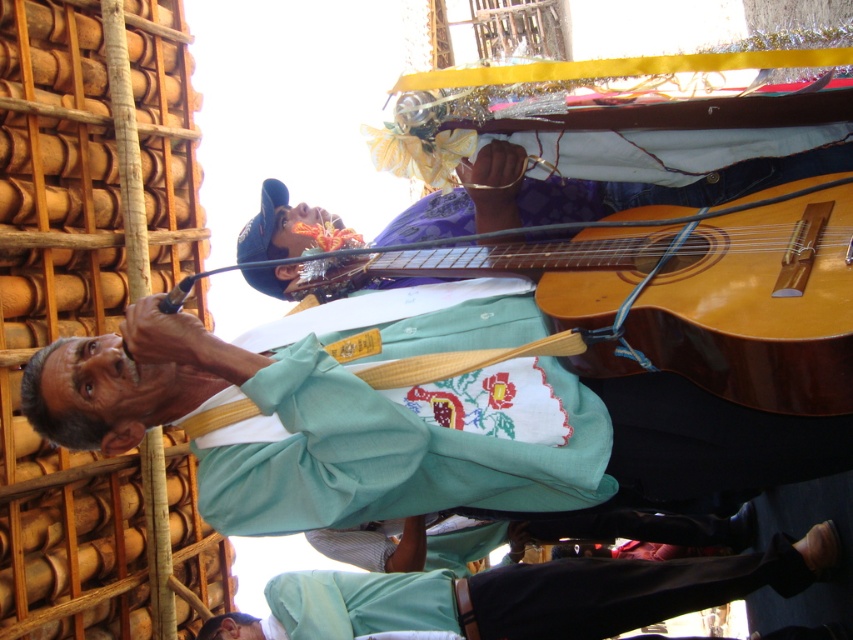
Based on the photo, does light brown wood guitar at center have a greater width compared to light blue fabric pants at lower center?

In fact, light brown wood guitar at center might be narrower than light blue fabric pants at lower center.

Can you confirm if light brown wood guitar at center is thinner than light blue fabric pants at lower center?

Correct, light brown wood guitar at center's width is less than light blue fabric pants at lower center's.

This screenshot has height=640, width=853. What do you see at coordinates (758, 307) in the screenshot?
I see `light brown wood guitar at center` at bounding box center [758, 307].

The height and width of the screenshot is (640, 853). I want to click on light brown wood guitar at center, so click(758, 307).